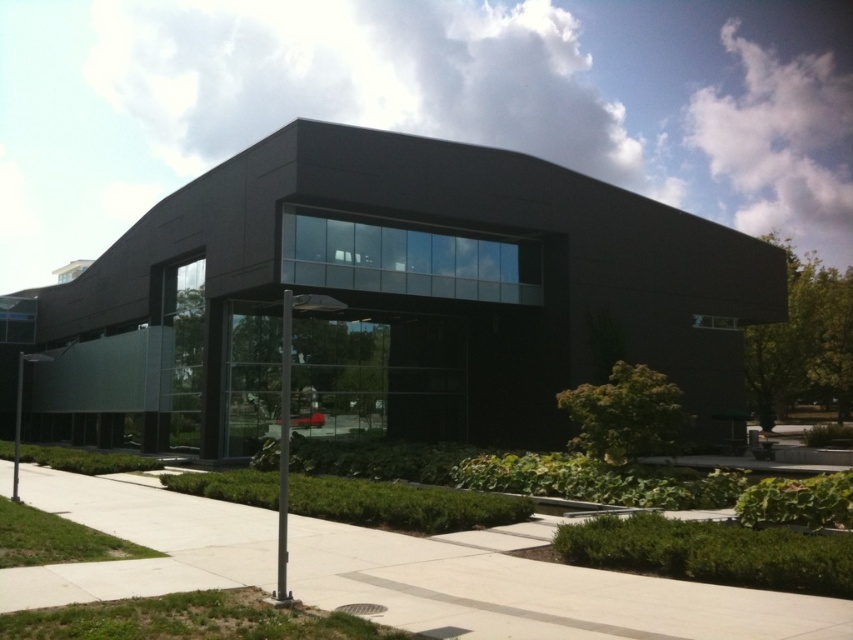
Question: Based on their relative distances, which object is farther from the concrete at center?

Choices:
 (A) metallic pole at lower left
 (B) black metallic pole at center

Answer: (A)

Question: Is the position of matte black building at center more distant than that of metallic pole at lower left?

Choices:
 (A) no
 (B) yes

Answer: (B)

Question: Can you confirm if matte black building at center is smaller than concrete at center?

Choices:
 (A) yes
 (B) no

Answer: (B)

Question: Which of these objects is positioned closest to the matte black building at center?

Choices:
 (A) metallic pole at lower left
 (B) concrete at center
 (C) black metallic pole at center

Answer: (A)

Question: Does concrete at center appear on the left side of metallic pole at lower left?

Choices:
 (A) no
 (B) yes

Answer: (A)

Question: Considering the real-world distances, which object is closest to the black metallic pole at center?

Choices:
 (A) matte black building at center
 (B) concrete at center
 (C) metallic pole at lower left

Answer: (B)